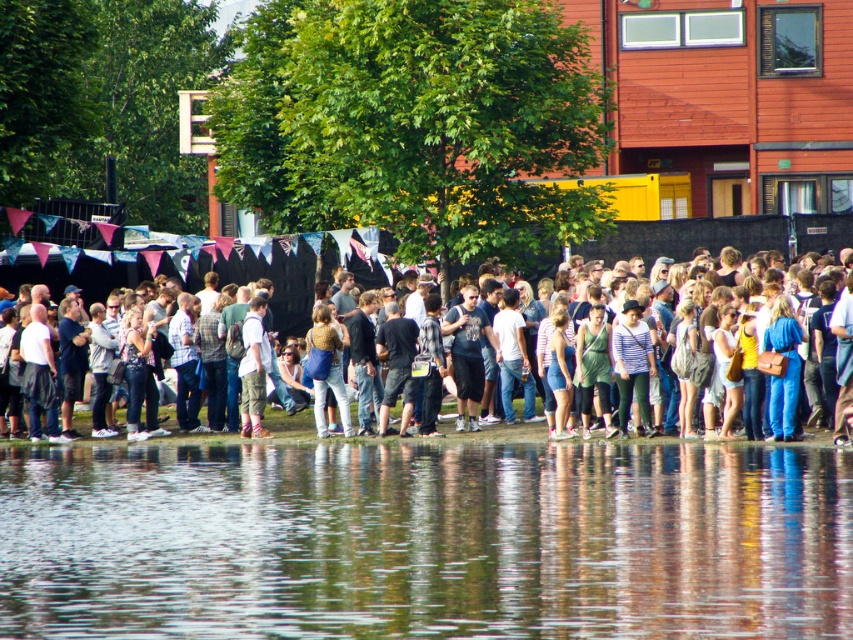
Which is in front, point (68, 280) or point (251, 385)?

Point (251, 385) is more forward.

Does denim shorts at center have a lesser height compared to light brown corduroy pants at center?

Yes.

Locate an element on the screen. denim shorts at center is located at coordinates (267, 276).

Can you confirm if transparent water at lower center is shorter than denim shorts at center?

Yes.

Is transparent water at lower center wider than denim shorts at center?

No, transparent water at lower center is not wider than denim shorts at center.

Is point (457, 476) closer to camera compared to point (273, 262)?

Yes, point (457, 476) is in front of point (273, 262).

Identify the location of transparent water at lower center. This screenshot has width=853, height=640. (425, 540).

Who is lower down, transparent water at lower center or light brown corduroy pants at center?

transparent water at lower center

Which of these two, transparent water at lower center or light brown corduroy pants at center, stands shorter?

transparent water at lower center

The height and width of the screenshot is (640, 853). Identify the location of transparent water at lower center. (425, 540).